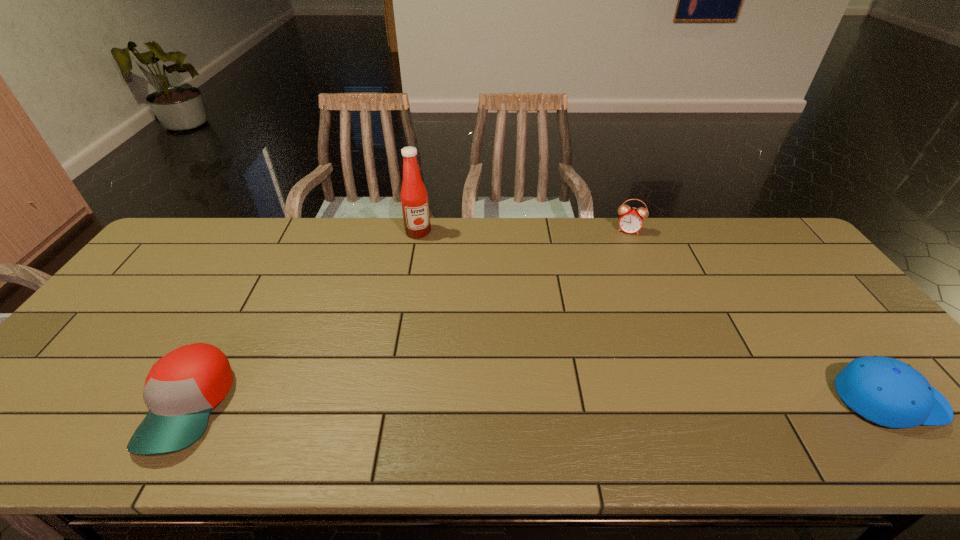
Find the location of a particular element. baseball cap is located at coordinates (182, 388).

Where is `the second object from left to right`? The height and width of the screenshot is (540, 960). the second object from left to right is located at coordinates [414, 199].

Find the location of a particular element. This screenshot has width=960, height=540. the tallest object is located at coordinates (414, 199).

Identify the location of alarm clock. This screenshot has height=540, width=960. (631, 221).

Locate an element on the screen. blank area located 0.200m on the front-facing side of the second object from left to right is located at coordinates (434, 279).

Locate an element on the screen. free spot located 0.110m on the front-facing side of the second object from left to right is located at coordinates (427, 260).

At what (x,y) coordinates should I click in order to perform the action: click on vacant space located on the front-facing side of the second object from left to right. Please return your answer as a coordinate pair (x, y). The height and width of the screenshot is (540, 960). Looking at the image, I should click on (428, 262).

Image resolution: width=960 pixels, height=540 pixels. Identify the location of vacant space located 0.190m on the clock face of the second object from right to left. (620, 271).

Find the location of a particular element. vacant area situated 0.050m on the clock face of the second object from right to left is located at coordinates (624, 244).

Locate an element on the screen. Image resolution: width=960 pixels, height=540 pixels. vacant region located 0.240m on the clock face of the second object from right to left is located at coordinates (618, 281).